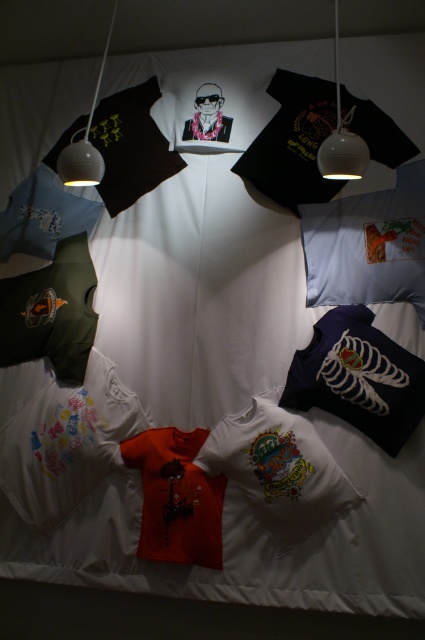
You are arranging a photo shoot and need to position the navy blue fabric pillow at lower right and the white glossy lamp at upper left. Based on their sizes, which object should you place first to ensure proper lighting?

The navy blue fabric pillow at lower right is much taller than the white glossy lamp at upper left. Since it is taller, you should position the navy blue fabric pillow at lower right first to ensure it doesn